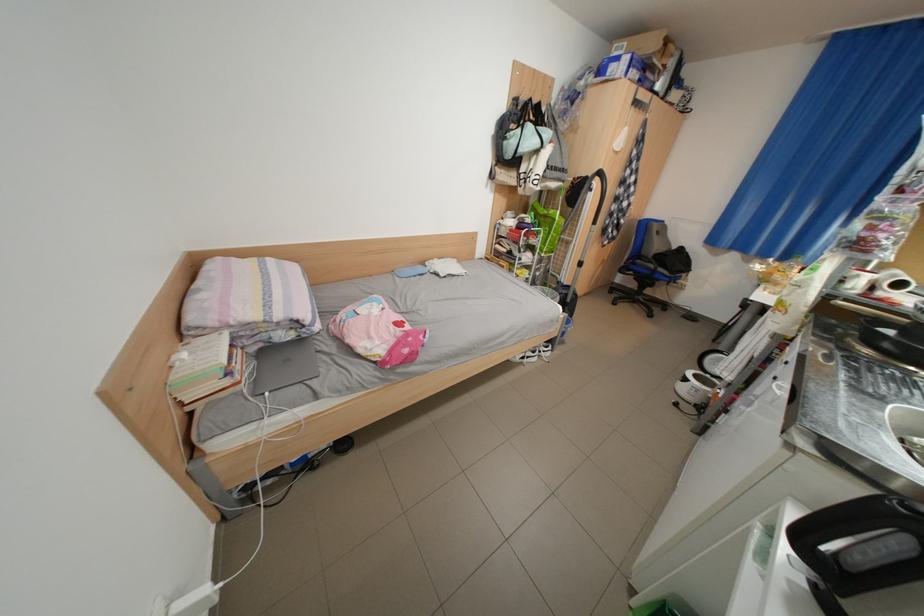
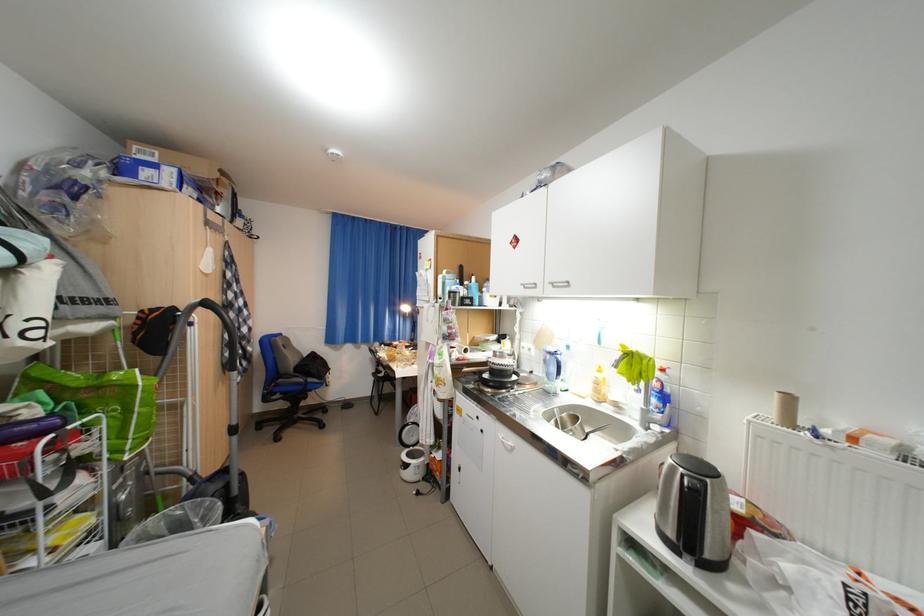
In the second image, find the point that corresponds to (x=640, y=270) in the first image.

(286, 395)